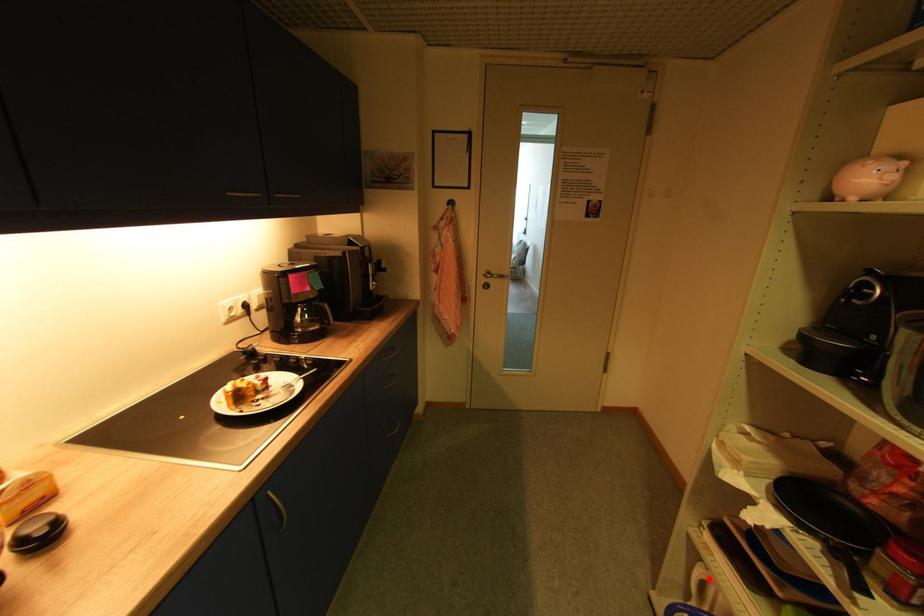
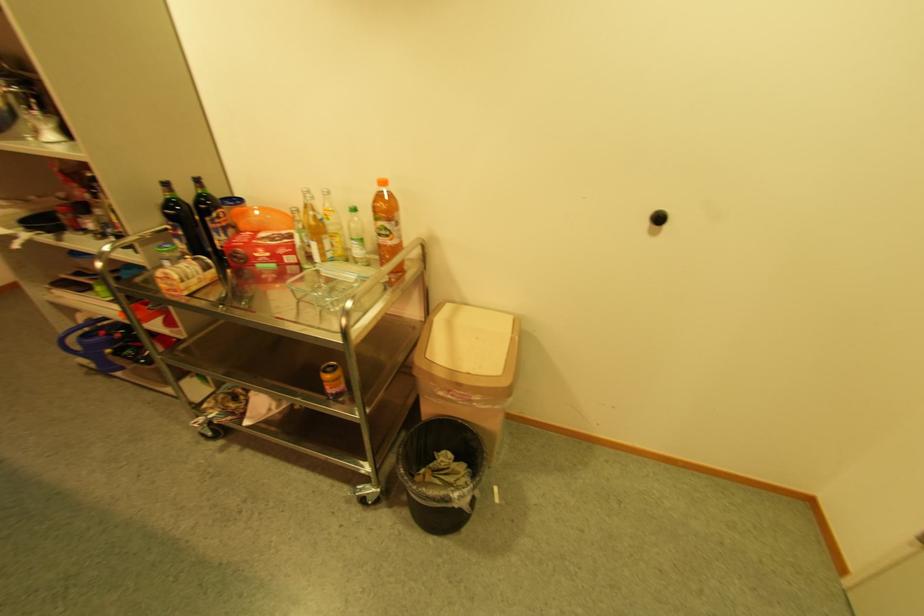
Question: I am providing you with two images of the same scene from different viewpoints. Given a red point in image1, look at the same physical point in image2. Is it:

Choices:
 (A) Closer to the viewpoint
 (B) Farther from the viewpoint

Answer: (A)